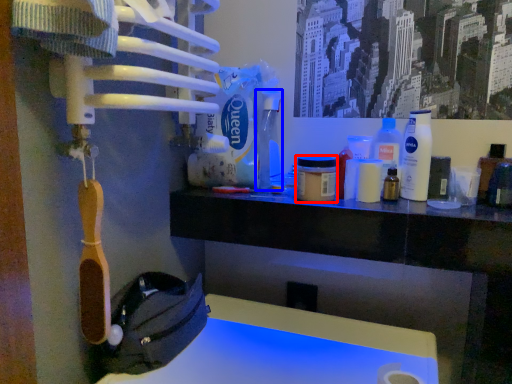
Question: Which object is further to the camera taking this photo, mouthwash (highlighted by a red box) or bottle (highlighted by a blue box)?

Choices:
 (A) mouthwash
 (B) bottle

Answer: (B)